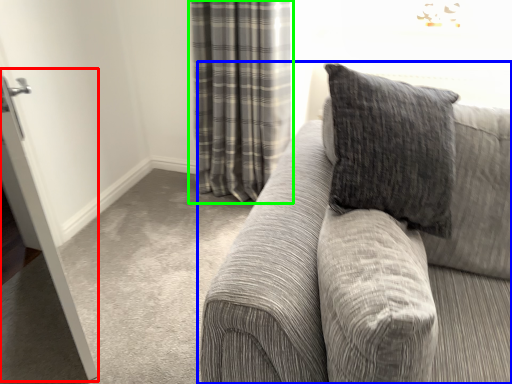
Question: Considering the real-world distances, which object is closest to screen door (highlighted by a red box)? studio couch (highlighted by a blue box) or curtain (highlighted by a green box).

Choices:
 (A) studio couch
 (B) curtain

Answer: (A)